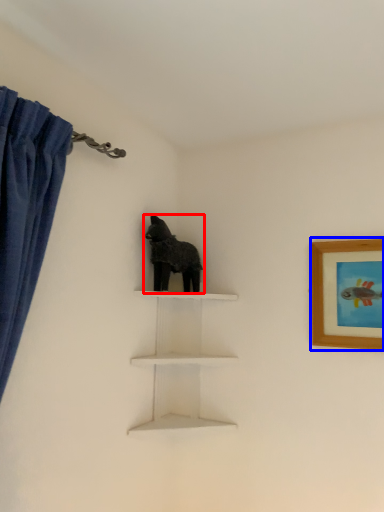
Question: Which object appears farthest to the camera in this image, animal (highlighted by a red box) or picture frame (highlighted by a blue box)?

Choices:
 (A) animal
 (B) picture frame

Answer: (A)